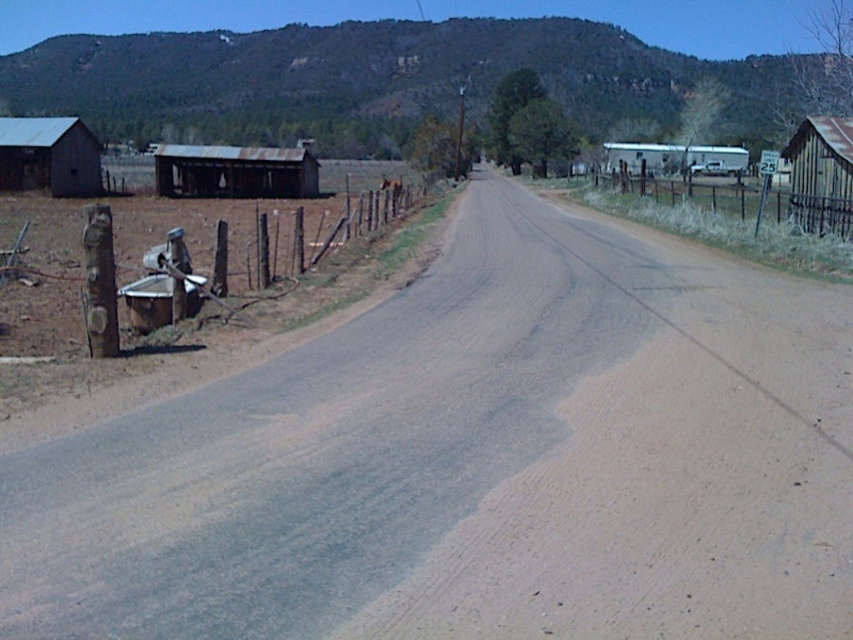
Question: Can you confirm if rusty metal fence at right is wider than rusty metal shack at left?

Choices:
 (A) yes
 (B) no

Answer: (B)

Question: Which point is farther from the camera taking this photo?

Choices:
 (A) (67, 164)
 (B) (746, 192)

Answer: (A)

Question: Which of the following is the farthest from the observer?

Choices:
 (A) gray gravel road at center
 (B) weathered wood fence at left
 (C) green grassy hill at upper center
 (D) rusty corrugated metal hut at right

Answer: (C)

Question: In this image, where is rusty metal fence at right located relative to white corrugated metal trailer at upper center?

Choices:
 (A) above
 (B) below

Answer: (B)

Question: Where is rusty corrugated metal hut at right located in relation to white corrugated metal trailer at upper center in the image?

Choices:
 (A) right
 (B) left

Answer: (B)

Question: Which of the following is the farthest from the observer?

Choices:
 (A) (352, 212)
 (B) (190, 148)

Answer: (B)